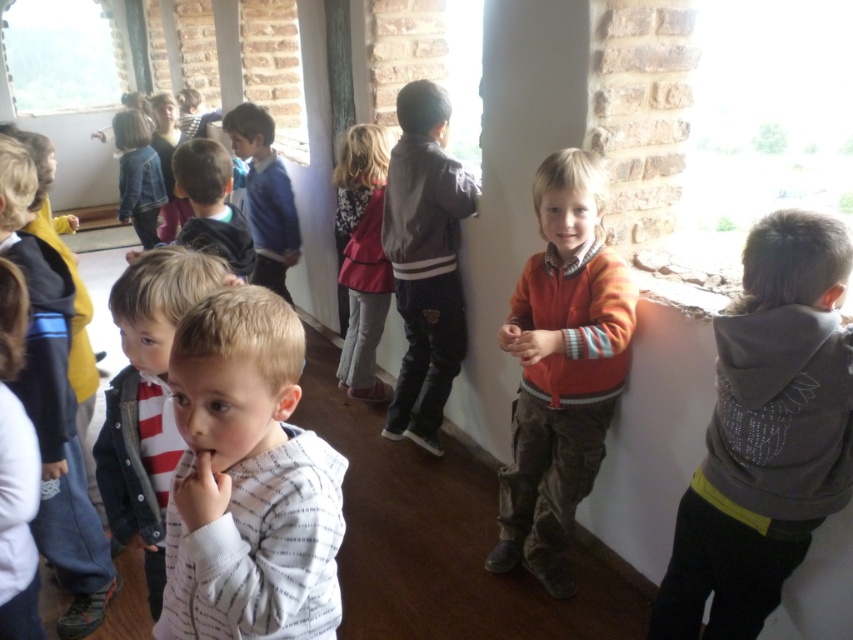
You are a delivery robot with a package that needs to be placed between the white striped hoodie at center and the transparent glass window at upper left. The package requires a space of 30 feet. Can you fit it there?

The distance between the white striped hoodie at center and the transparent glass window at upper left is 29.80 feet, which is slightly less than the required 30 feet. Therefore, the package cannot be placed there as it does not have enough space.

You are a photographer trying to capture a shot of the light pink fabric dress at center without the clear glass window at upper right obstructing the view. Is this possible given their positions?

The clear glass window at upper right is further to the viewer than the light pink fabric dress at center, meaning the window is closer to you. Therefore, you cannot capture the dress without the window obstructing the view.

You are a photographer standing at the entrance of the room. You want to take a photo of the white striped hoodie at center. Based on its position coordinates, where should you aim your camera?

The white striped hoodie at center is located at coordinates point (248,481), so you should aim your camera towards the lower right area of the frame to capture it.